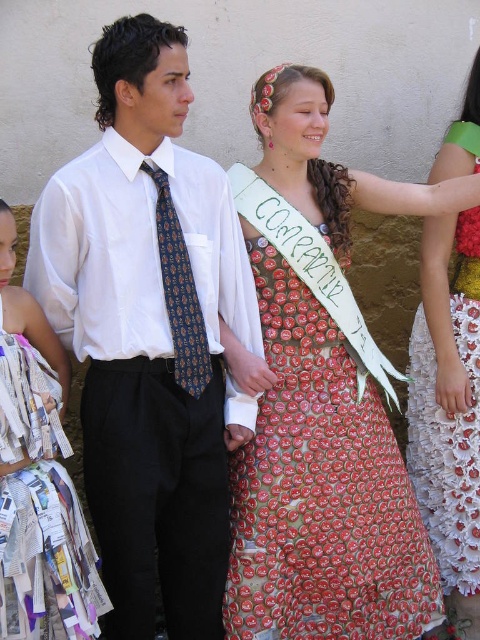
Question: Is printed fabric dress at center bigger than dark blue silk tie at center?

Choices:
 (A) yes
 (B) no

Answer: (A)

Question: Estimate the real-world distances between objects in this image. Which object is closer to the recycled paper dress at center?

Choices:
 (A) dark blue silk tie at center
 (B) matte white shirt at center
 (C) white textured fabric dress at right

Answer: (B)

Question: Can you confirm if white textured fabric dress at right is positioned to the left of dark blue silk tie at center?

Choices:
 (A) yes
 (B) no

Answer: (B)

Question: Which of these objects is positioned closest to the white textured fabric dress at right?

Choices:
 (A) printed fabric dress at center
 (B) dark blue silk tie at center
 (C) matte white shirt at center

Answer: (A)

Question: Can you confirm if printed fabric dress at center is positioned to the right of dark blue silk tie at center?

Choices:
 (A) yes
 (B) no

Answer: (A)

Question: Which point is closer to the camera taking this photo?

Choices:
 (A) pyautogui.click(x=81, y=253)
 (B) pyautogui.click(x=290, y=608)

Answer: (A)